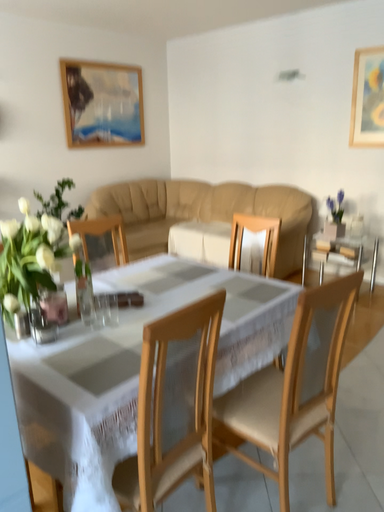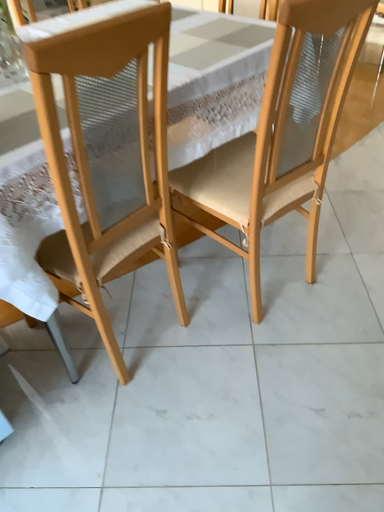
Question: Which way did the camera rotate in the video?

Choices:
 (A) rotated upward
 (B) rotated downward

Answer: (B)